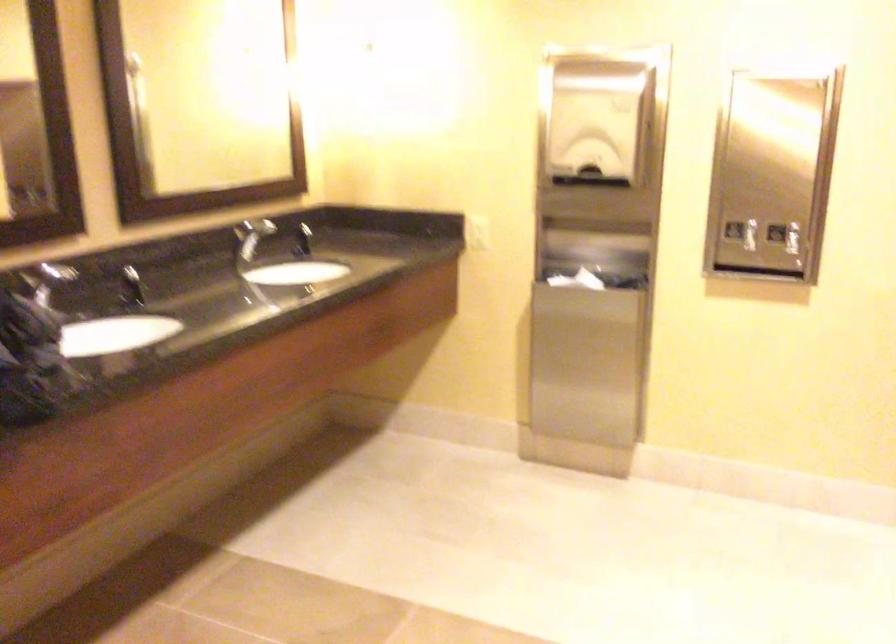
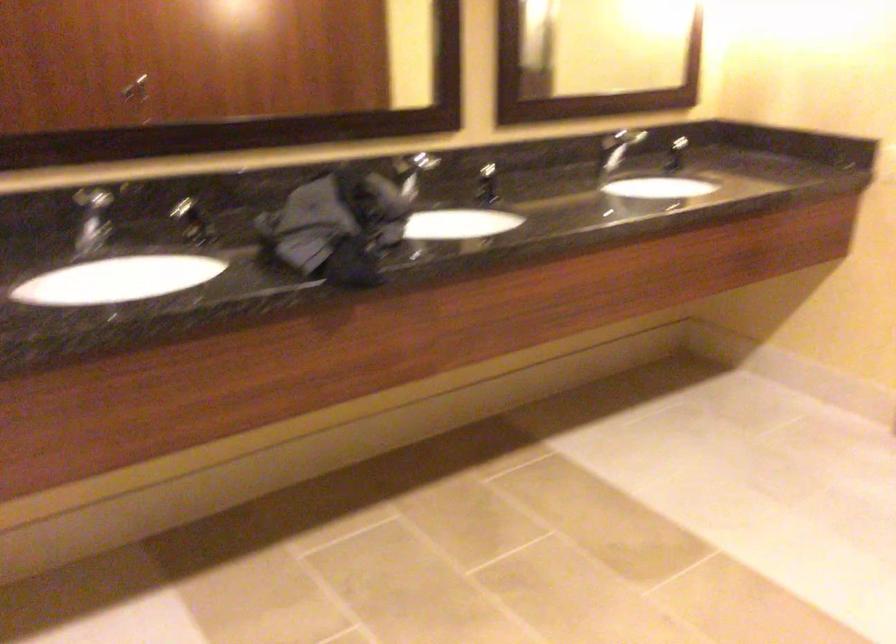
Locate, in the second image, the point that corresponds to [138,290] in the first image.

(487, 184)